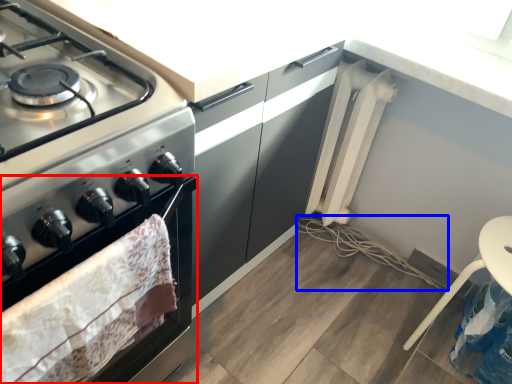
Question: Which of the following is the closest to the observer, oven (highlighted by a red box) or string (highlighted by a blue box)?

Choices:
 (A) oven
 (B) string

Answer: (A)